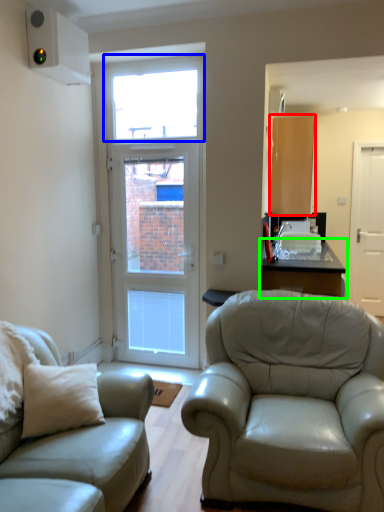
Question: Which object is the farthest from cabinetry (highlighted by a red box)? Choose among these: window (highlighted by a blue box) or table (highlighted by a green box).

Choices:
 (A) window
 (B) table

Answer: (A)